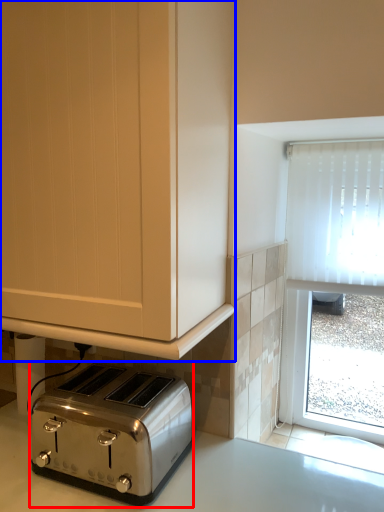
Question: Which object appears farthest to the camera in this image, toaster (highlighted by a red box) or cabinetry (highlighted by a blue box)?

Choices:
 (A) toaster
 (B) cabinetry

Answer: (A)